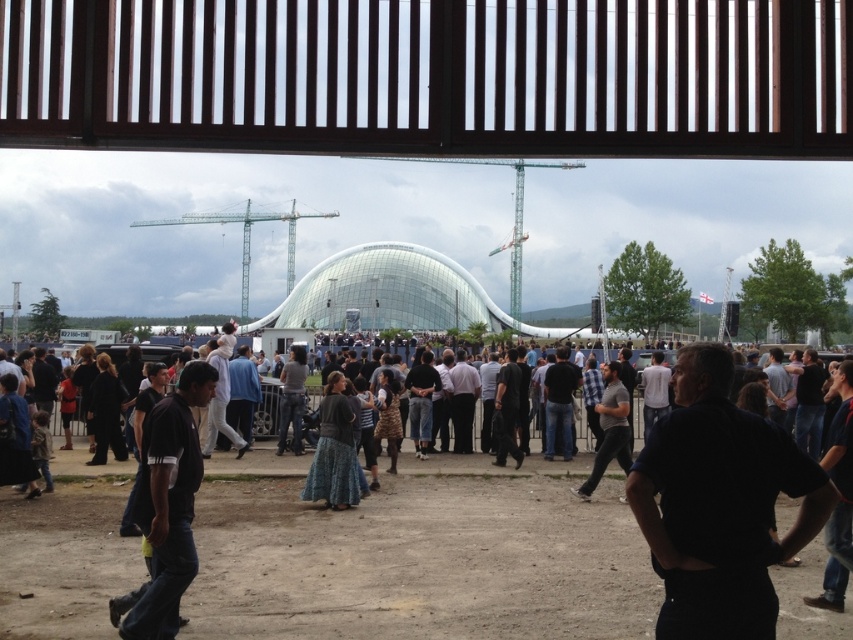
Question: Considering the relative positions of dark blue jeans at center and dark blue shirt at center in the image provided, where is dark blue jeans at center located with respect to dark blue shirt at center?

Choices:
 (A) above
 (B) below

Answer: (B)

Question: Considering the real-world distances, which object is farthest from the denim skirt at center?

Choices:
 (A) gray cotton shirt at center
 (B) dark blue jeans at lower left
 (C) dark blue shirt at center
 (D) dark blue jeans at center

Answer: (C)

Question: Can you confirm if dark blue jeans at center is wider than denim skirt at center?

Choices:
 (A) yes
 (B) no

Answer: (A)

Question: Among these objects, which one is nearest to the camera?

Choices:
 (A) dark blue shirt at center
 (B) gray cotton shirt at center

Answer: (A)

Question: Which point is closer to the camera?

Choices:
 (A) (650, 445)
 (B) (148, 536)

Answer: (A)

Question: Is dark blue jeans at lower left thinner than denim skirt at center?

Choices:
 (A) no
 (B) yes

Answer: (B)